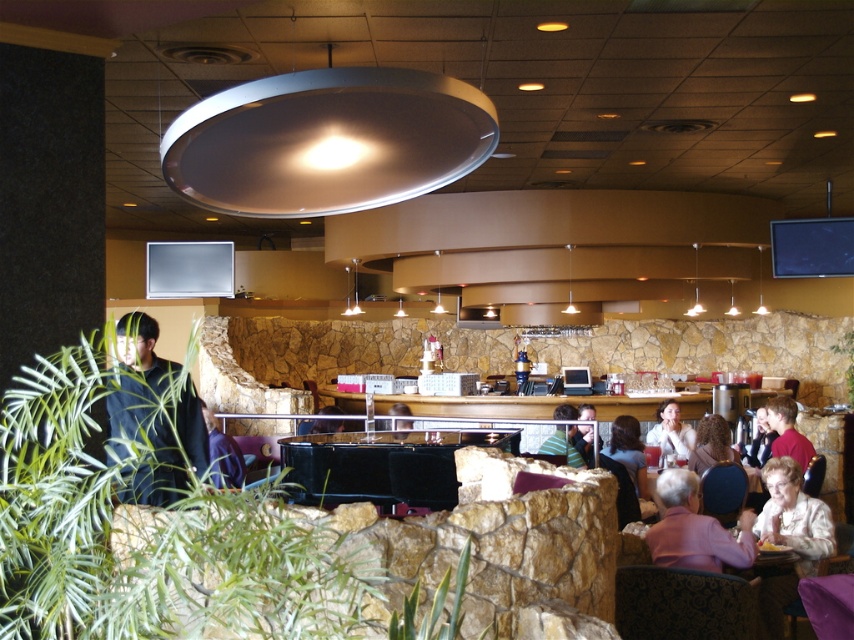
You are a photographer taking a picture of the scene. You notice the dark brown hair at center and the striped shirt at center. Which object is positioned lower in the image?

The dark brown hair at center is below the striped shirt at center, so it is positioned lower in the image.

From the picture: You are a customer entering the restaurant and see the black glossy table at center and the blurred hair at center. Which object is positioned to the left of the other?

The black glossy table at center is to the left of blurred hair at center.

Consider the image. You are a server in a restaurant and need to deliver a tray of dishes to a customer. The customer is sitting at the blurred hair at center, and you are standing at the black glossy table at center. Can you walk directly to the customer without moving any obstacles?

The distance between the black glossy table at center and the blurred hair at center is 10.84 feet, so yes, you can walk directly to the customer without needing to move any obstacles as there is sufficient space between them.